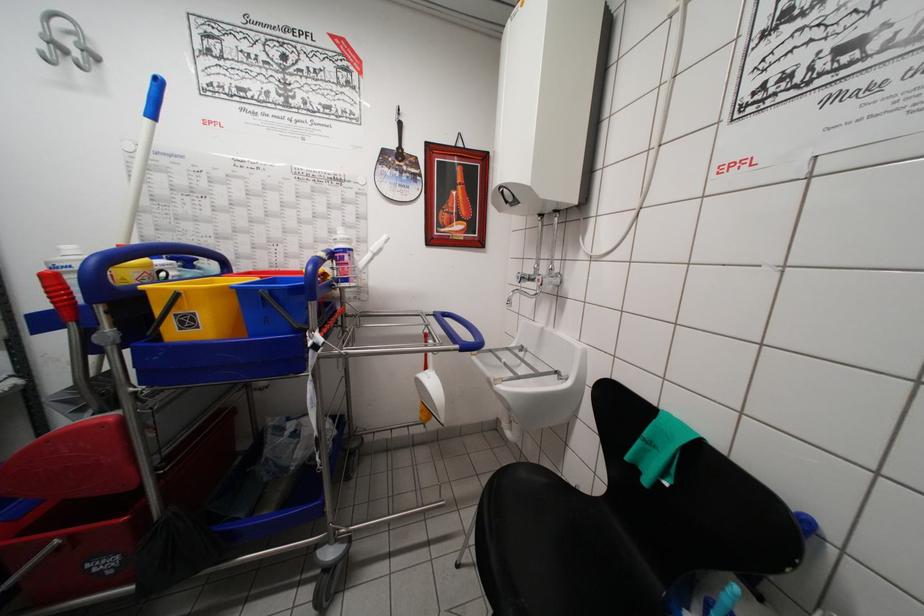
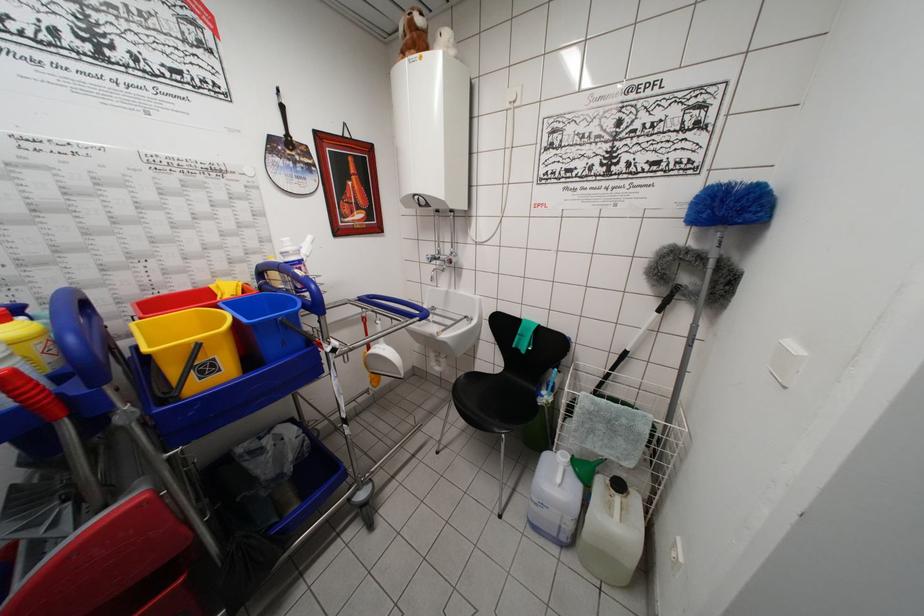
Find the pixel in the second image that matches pixel 578 490 in the first image.

(491, 379)